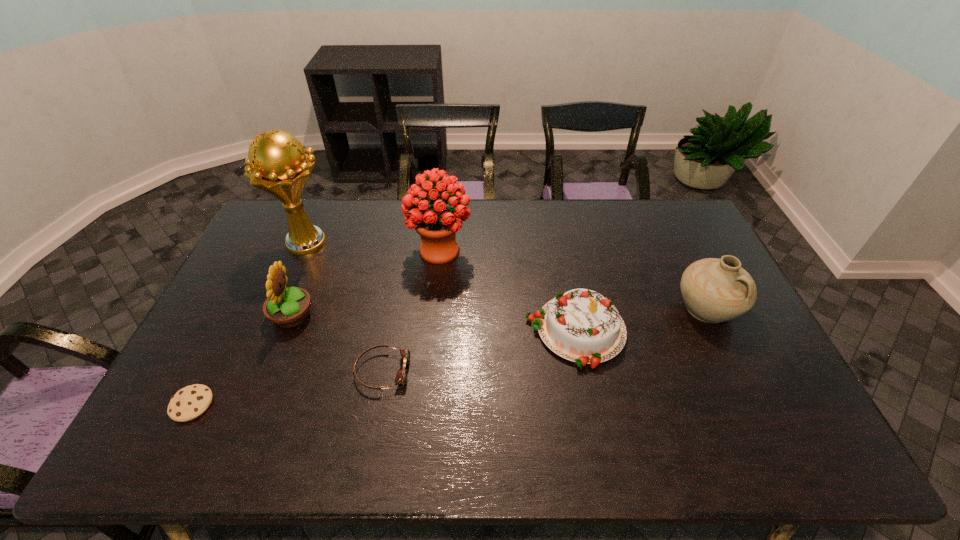
This screenshot has height=540, width=960. In order to click on vacant point located between the sunflower and the cake in this screenshot , I will do `click(434, 323)`.

Locate an element on the screen. Image resolution: width=960 pixels, height=540 pixels. vacant space in between the pottery and the bouquet is located at coordinates (573, 280).

The width and height of the screenshot is (960, 540). I want to click on vacant area between the sunflower and the tallest object, so click(300, 279).

Locate an element on the screen. Image resolution: width=960 pixels, height=540 pixels. vacant area that lies between the cake and the sunflower is located at coordinates (434, 323).

Locate an element on the screen. the fifth closest object to the sunflower is located at coordinates (583, 326).

Identify which object is the sixth closest to the goggles. Please provide its 2D coordinates. Your answer should be formatted as a tuple, i.e. [(x, y)], where the tuple contains the x and y coordinates of a point satisfying the conditions above.

[(714, 290)]

Find the location of a particular element. The image size is (960, 540). vacant region that satisfies the following two spatial constraints: 1. on the back side of the cookie; 2. on the right side of the sixth shortest object is located at coordinates (270, 251).

You are a GUI agent. You are given a task and a screenshot of the screen. Output one action in this format:
    pyautogui.click(x=<x>, y=<y>)
    Task: Click on the blank area in the image that satisfies the following two spatial constraints: 1. on the front side of the pottery; 2. on the face of the sunflower
    
    Given the screenshot: What is the action you would take?
    pyautogui.click(x=710, y=316)

Locate an element on the screen. The height and width of the screenshot is (540, 960). vacant area in the image that satisfies the following two spatial constraints: 1. on the back side of the shortest object; 2. on the right side of the bouquet is located at coordinates (270, 251).

This screenshot has height=540, width=960. Find the location of `free location that satisfies the following two spatial constraints: 1. at the front of the fifth tallest object where the globe is prominent; 2. on the left side of the tallest object`. free location that satisfies the following two spatial constraints: 1. at the front of the fifth tallest object where the globe is prominent; 2. on the left side of the tallest object is located at coordinates (271, 332).